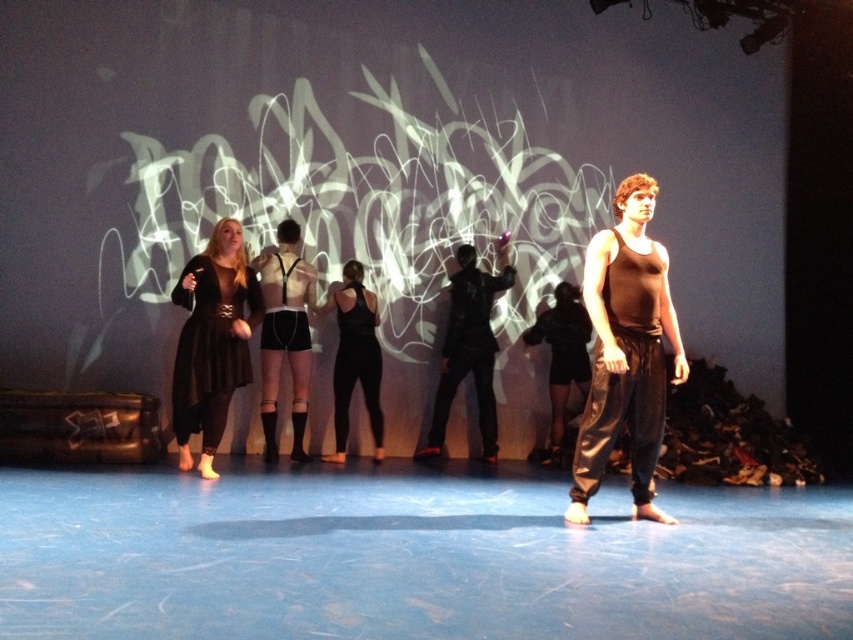
Question: Is matte black shorts at center thinner than black matte tank top at center?

Choices:
 (A) no
 (B) yes

Answer: (A)

Question: Which of the following is the farthest from the observer?

Choices:
 (A) brown matte tank top at center
 (B) matte black shorts at center

Answer: (B)

Question: Can you confirm if brown matte tank top at center is positioned to the right of matte black dress at left?

Choices:
 (A) yes
 (B) no

Answer: (A)

Question: Is brown matte tank top at center positioned before matte black shorts at center?

Choices:
 (A) no
 (B) yes

Answer: (B)

Question: Which point is closer to the camera?

Choices:
 (A) (448, 385)
 (B) (229, 262)
 (C) (367, 291)
 (D) (281, 301)

Answer: (B)

Question: Among these objects, which one is nearest to the camera?

Choices:
 (A) matte black shorts at center
 (B) black matte pants at center

Answer: (A)